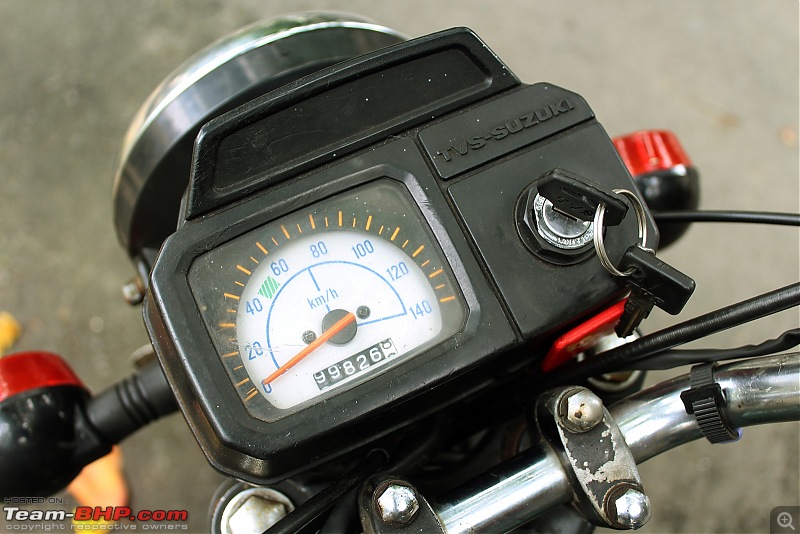
Identify the location of black wires. This screenshot has height=534, width=800. (674, 339), (746, 214).